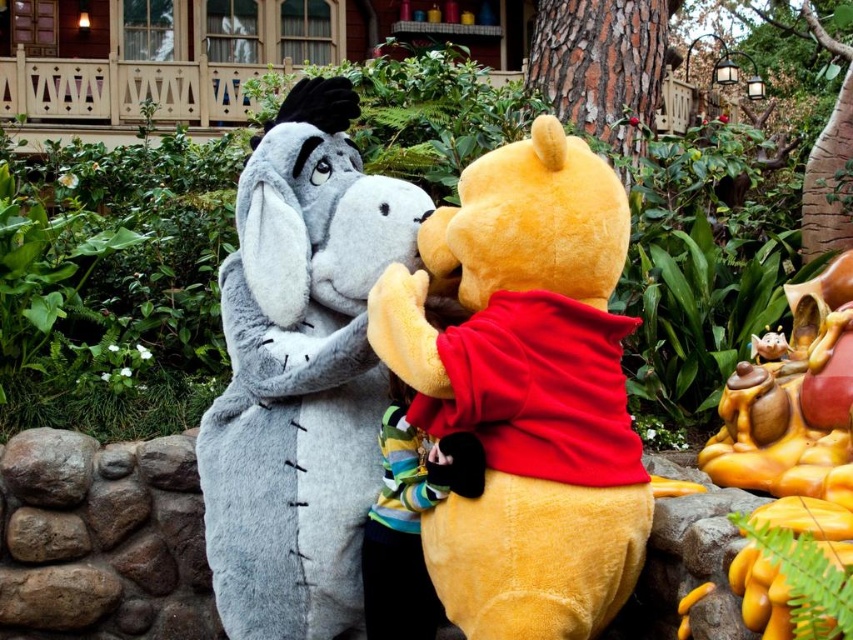
Question: Is fluffy yellow bear at center closer to camera compared to striped fabric shirt at center?

Choices:
 (A) no
 (B) yes

Answer: (B)

Question: Does fluffy gray donkey at center have a larger size compared to striped fabric shirt at center?

Choices:
 (A) no
 (B) yes

Answer: (B)

Question: Which point appears closest to the camera in this image?

Choices:
 (A) coord(260,378)
 (B) coord(392,380)
 (C) coord(618,195)

Answer: (C)

Question: Where is smooth yellow statue at right located in relation to striped fabric shirt at center in the image?

Choices:
 (A) above
 (B) below

Answer: (A)

Question: Which object is positioned farthest from the fluffy yellow bear at center?

Choices:
 (A) striped fabric shirt at center
 (B) fluffy gray donkey at center

Answer: (B)

Question: Which object is farther from the camera taking this photo?

Choices:
 (A) fluffy yellow bear at center
 (B) fluffy gray donkey at center
 (C) striped fabric shirt at center

Answer: (B)